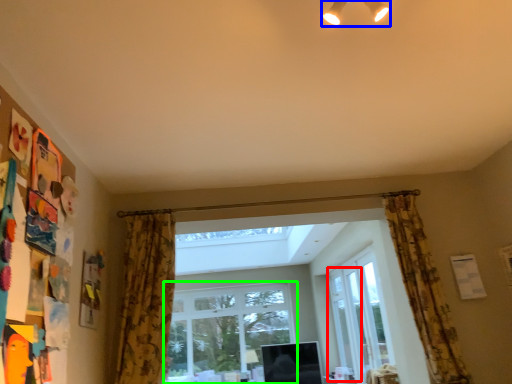
Question: Based on their relative distances, which object is farther from screen door (highlighted by a red box)? Choose from light fixture (highlighted by a blue box) and window (highlighted by a green box).

Choices:
 (A) light fixture
 (B) window

Answer: (A)